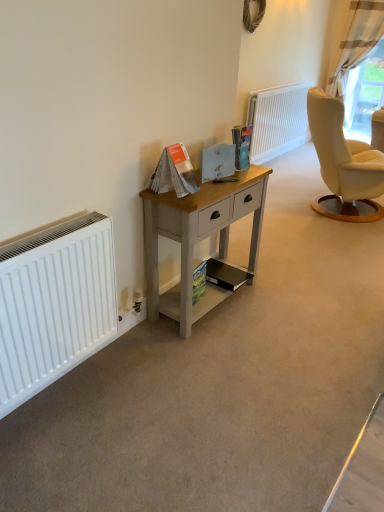
This screenshot has width=384, height=512. Find the location of `vacant area that lies between light gray wood desk at center and white matte radiator at lower left, placed as the second radiator when sorted from top to bottom`. vacant area that lies between light gray wood desk at center and white matte radiator at lower left, placed as the second radiator when sorted from top to bottom is located at coordinates (129, 364).